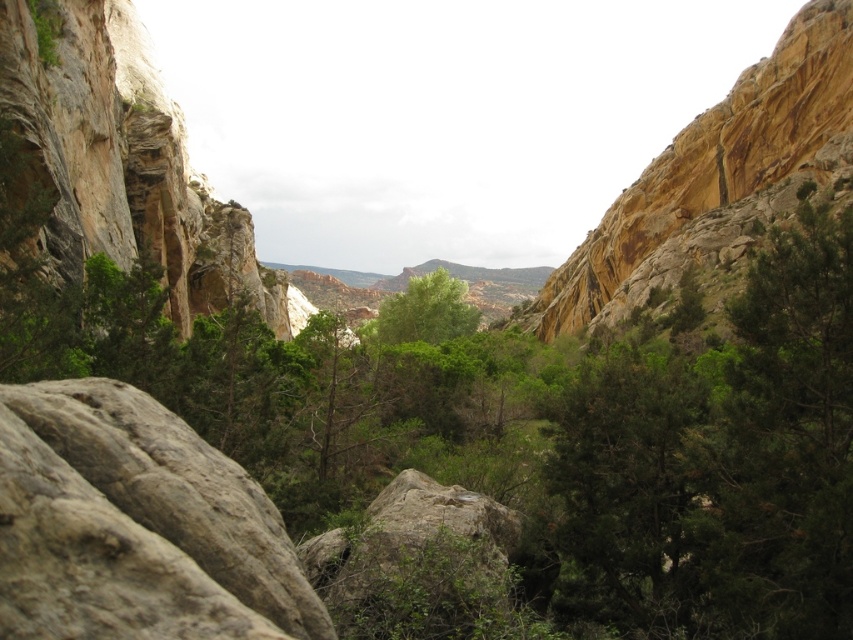
Question: Which point is closer to the camera?

Choices:
 (A) (737, 160)
 (B) (422, 317)
 (C) (213, 484)

Answer: (C)

Question: Which object is the farthest from the green leafy tree at center?

Choices:
 (A) gray rough rock at lower left
 (B) yellowish rock cliff at right

Answer: (A)

Question: Can you confirm if gray rough rock at lower left is positioned to the right of green leafy tree at center?

Choices:
 (A) no
 (B) yes

Answer: (A)

Question: Considering the real-world distances, which object is closest to the yellowish rock cliff at right?

Choices:
 (A) gray rough rock at lower left
 (B) green leafy tree at center

Answer: (B)

Question: Does gray rough rock at lower left have a greater width compared to green leafy tree at center?

Choices:
 (A) yes
 (B) no

Answer: (B)

Question: Is gray rough rock at lower left below green leafy tree at center?

Choices:
 (A) yes
 (B) no

Answer: (A)